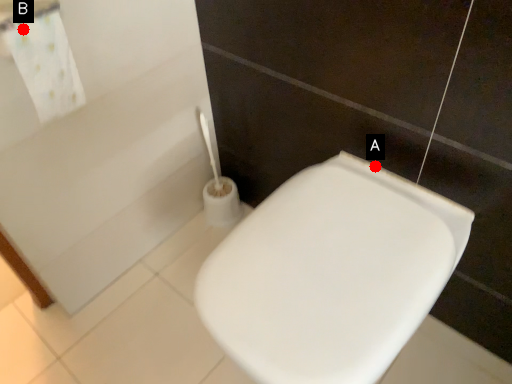
Question: Two points are circled on the image, labeled by A and B beside each circle. Which point appears farthest from the camera in this image?

Choices:
 (A) A is further
 (B) B is further

Answer: (A)